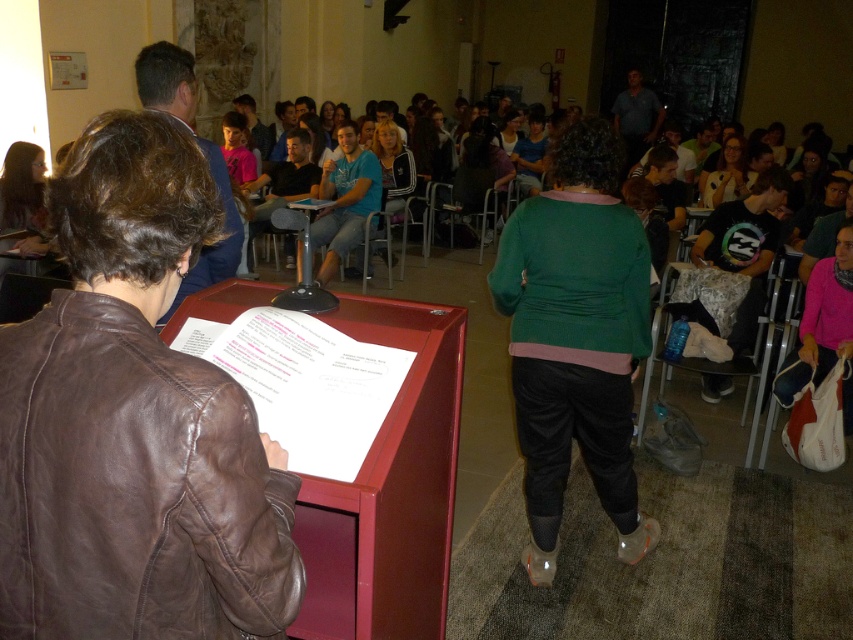
You are a student who needs to place a 12 cm tall book on either the matte red podium at center or the metallic silver table at center. Which surface can accommodate the book without it being too tall?

The matte red podium at center has a greater height compared to the metallic silver table at center, so the book will fit better on the metallic silver table at center since it is shorter and the book won

You are standing at the entrance of the classroom and need to find the black fabric chair at lower right. According to the coordinates provided, where should you look to locate it?

The black fabric chair at lower right is located at point 0.564 on the horizontal axis and 0.853 on the vertical axis, so you should look towards the lower right area of the room based on these coordinates.

You are standing in the classroom and want to take a photo of the leather jacket at left. Where should you aim your camera to capture it?

You should aim your camera at the point with coordinates (132,486) to capture the leather jacket at left.